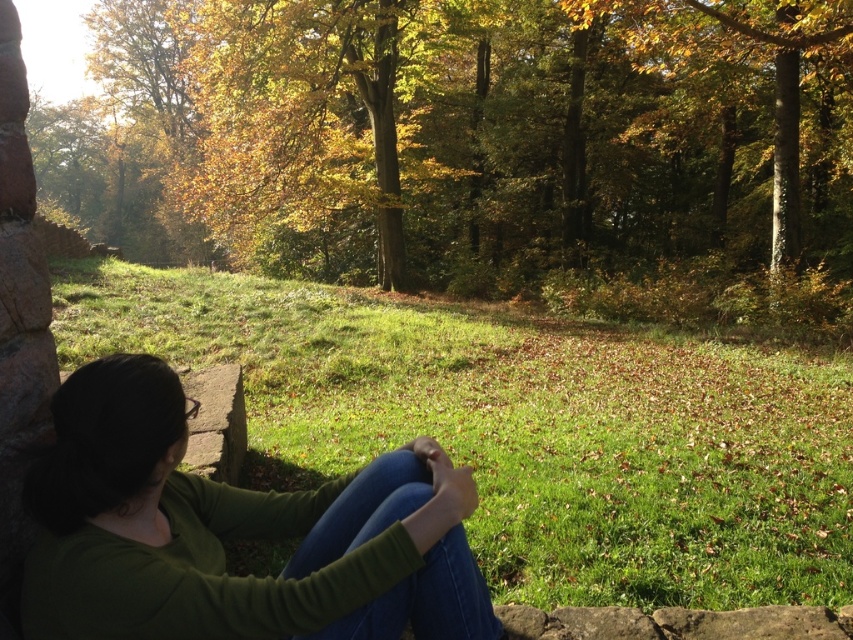
You are standing at the stone ledge where the person is sitting. Looking out over the grassy field, you notice a point marked at coordinates (474, 145). What object is located at that point?

The point at coordinates (474, 145) marks the location of the green leafy tree at upper left.

In the scene shown: You are planning to place a bench between the green leafy tree at upper left and the golden leafy tree at center. The bench is 2 meters long. Will there be enough space between them to place the bench horizontally?

The distance between the green leafy tree at upper left and the golden leafy tree at center is 9.39 meters. Since the bench is only 2 meters long, there is sufficient space to place it horizontally between them.

You are planning to take a photo of the gray concrete stone at left and the green leafy tree at upper left. Which object should you focus on first if you want to capture both in a single frame without moving the camera? Explain your reasoning based on their sizes in the scene.

The green leafy tree at upper left is wider than the gray concrete stone at left. To include both in a single frame without moving the camera, you should focus on the green leafy tree at upper left first since it occupies more space in the scene, ensuring it fits within the frame while adjusting for the smaller gray concrete stone at left.